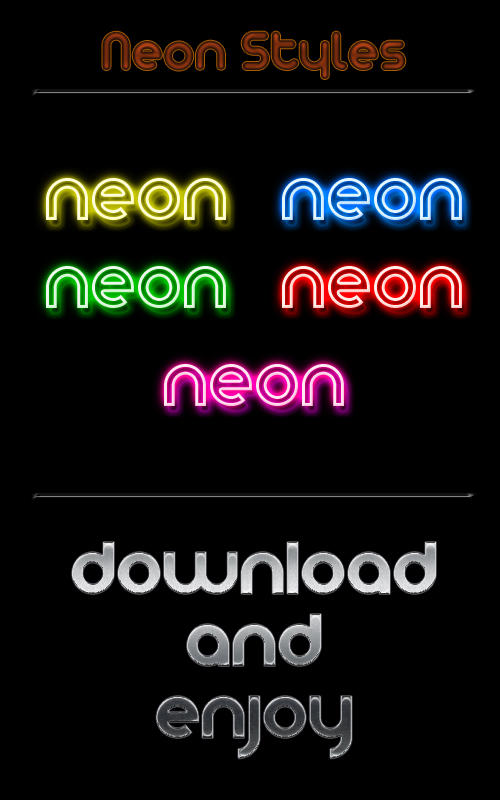
This screenshot has width=500, height=800. I want to click on light under neon styles, so click(269, 93).